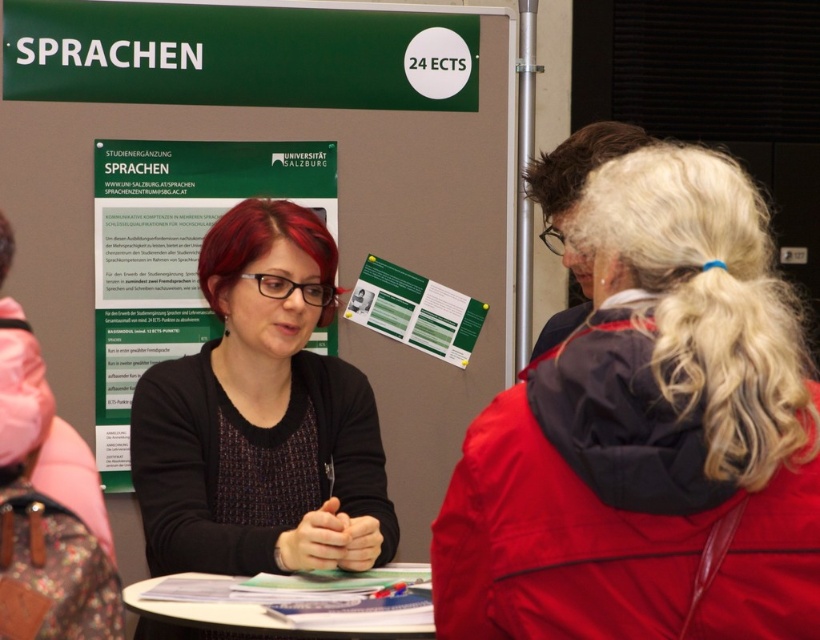
Question: Based on their relative distances, which object is farther from the matte black sweater at center?

Choices:
 (A) white paper at center
 (B) green paper poster at center
 (C) green cardboard poster at center
 (D) green paper at center

Answer: (D)

Question: Which object appears farthest from the camera in this image?

Choices:
 (A) white paper at center
 (B) matte black sweater at center

Answer: (B)

Question: Does dark blue jacket at center have a lesser width compared to green paper poster at center?

Choices:
 (A) yes
 (B) no

Answer: (A)

Question: Is green paper at center further to camera compared to white paper at center?

Choices:
 (A) yes
 (B) no

Answer: (A)

Question: Which point is closer to the camera?

Choices:
 (A) (485, 461)
 (B) (431, 310)

Answer: (A)

Question: Is green paper at center to the right of white paper at center from the viewer's perspective?

Choices:
 (A) yes
 (B) no

Answer: (A)